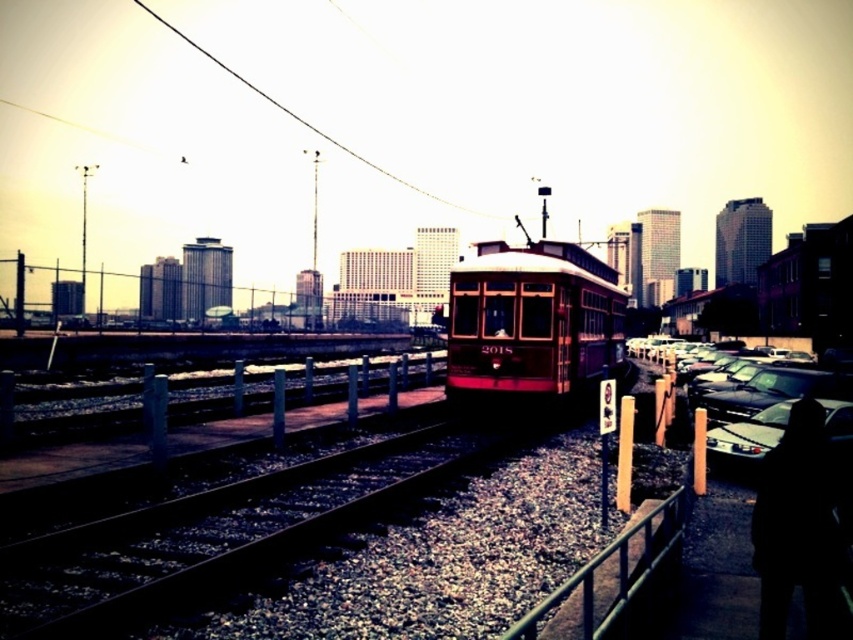
Question: Can you confirm if shiny red trolley at center is smaller than black fabric at lower right?

Choices:
 (A) yes
 (B) no

Answer: (B)

Question: Does black fabric at lower right have a larger size compared to black wire at upper center?

Choices:
 (A) no
 (B) yes

Answer: (A)

Question: Which point is closer to the camera taking this photo?

Choices:
 (A) (779, 492)
 (B) (793, 390)
 (C) (146, 12)
 (D) (476, 317)

Answer: (A)

Question: Does black fabric at lower right have a lesser width compared to shiny black sedan at right?

Choices:
 (A) no
 (B) yes

Answer: (B)

Question: Among these objects, which one is nearest to the camera?

Choices:
 (A) metal/rustic rail at lower center
 (B) shiny black sedan at right

Answer: (A)

Question: Which point appears closest to the camera in this image?

Choices:
 (A) (834, 525)
 (B) (421, 189)
 (C) (543, 620)
 (D) (717, 394)

Answer: (A)